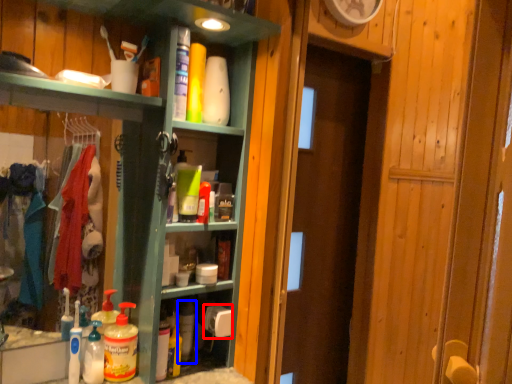
Question: Which of the following is the farthest to the observer, toilet paper (highlighted by a red box) or cleaning product (highlighted by a blue box)?

Choices:
 (A) toilet paper
 (B) cleaning product

Answer: (A)